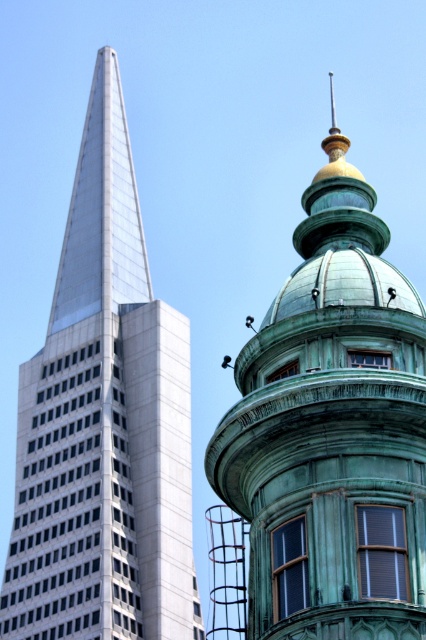
Can you confirm if green patina dome at upper center is thinner than metallic glass skyscraper at left?

Yes, green patina dome at upper center is thinner than metallic glass skyscraper at left.

Who is higher up, green patina dome at upper center or metallic glass skyscraper at left?

green patina dome at upper center

Is point (273, 483) closer to viewer compared to point (75, 556)?

Yes, it is in front of point (75, 556).

This screenshot has width=426, height=640. In order to click on green patina dome at upper center in this screenshot , I will do `click(331, 429)`.